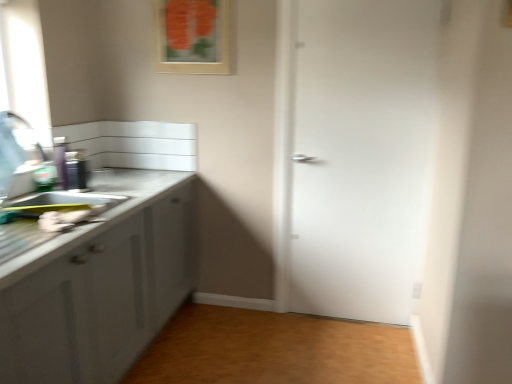
Question: Is metallic canister at left situated inside brushed metal faucet at left or outside?

Choices:
 (A) inside
 (B) outside

Answer: (B)

Question: Looking at the image, does metallic canister at left seem bigger or smaller compared to brushed metal faucet at left?

Choices:
 (A) small
 (B) big

Answer: (A)

Question: Based on their relative distances, which object is nearer to the wooden floor at lower center?

Choices:
 (A) brushed metal faucet at left
 (B) matte white sink at left
 (C) metallic canister at left
 (D) wooden picture frame at upper center
 (E) white matte door at center

Answer: (E)

Question: Considering the real-world distances, which object is farthest from the matte white sink at left?

Choices:
 (A) wooden picture frame at upper center
 (B) white matte door at center
 (C) metallic canister at left
 (D) wooden floor at lower center
 (E) brushed metal faucet at left

Answer: (B)